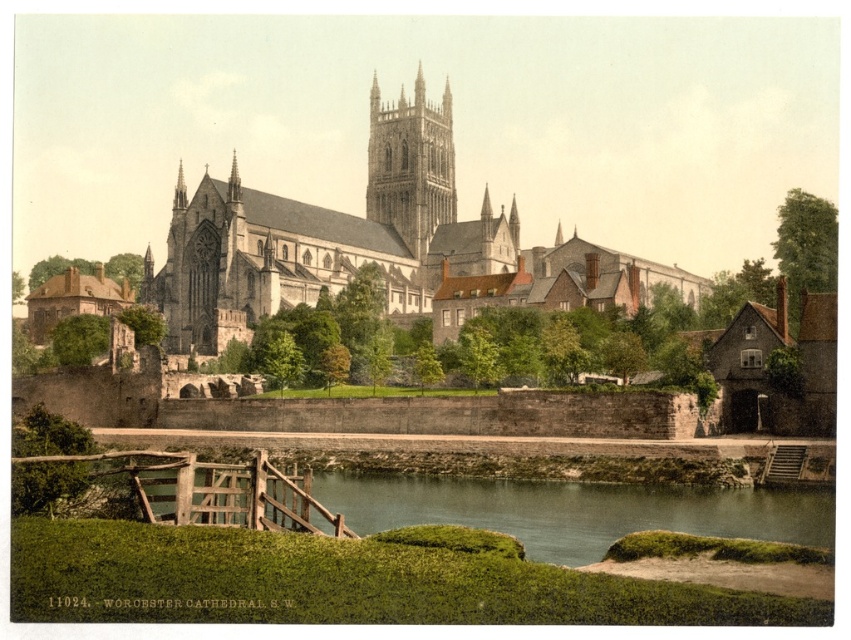
Is green grassy bank at lower center to the right of brown stone tower at center from the viewer's perspective?

Correct, you'll find green grassy bank at lower center to the right of brown stone tower at center.

Which is behind, point (553, 545) or point (438, 193)?

Point (438, 193)

Image resolution: width=851 pixels, height=640 pixels. I want to click on green grassy bank at lower center, so click(575, 509).

Does white stone church at center have a larger size compared to brown stone tower at center?

Correct, white stone church at center is larger in size than brown stone tower at center.

From the picture: Can you confirm if white stone church at center is shorter than brown stone tower at center?

In fact, white stone church at center may be taller than brown stone tower at center.

Does point (312, 285) come closer to viewer compared to point (455, 193)?

Yes, it is.

Locate an element on the screen. The image size is (851, 640). white stone church at center is located at coordinates (372, 243).

How much distance is there between white stone church at center and green grassy bank at lower center?

A distance of 42.53 meters exists between white stone church at center and green grassy bank at lower center.

Consider the image. Between white stone church at center and green grassy bank at lower center, which one is positioned higher?

Positioned higher is white stone church at center.

Who is more distant from viewer, (180, 234) or (558, 561)?

Point (180, 234)

Identify the location of white stone church at center. The height and width of the screenshot is (640, 851). [x=372, y=243].